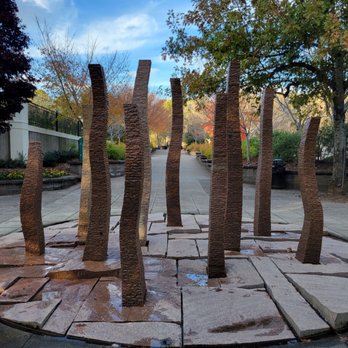
Locate an element on the screen. trash can is located at coordinates (276, 171).